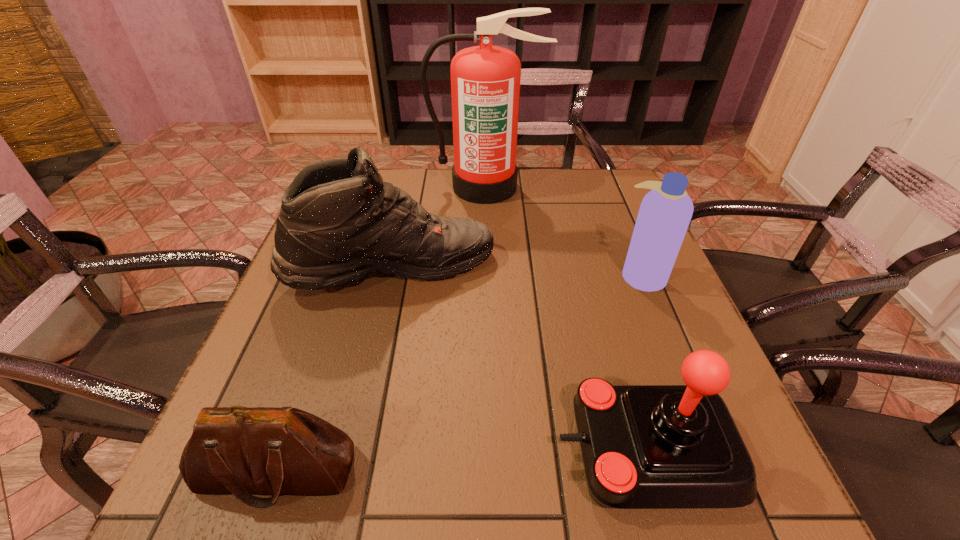
The image size is (960, 540). I want to click on vacant space that's between the shortest object and the shampoo, so click(459, 373).

This screenshot has height=540, width=960. Find the location of `vacant region between the joystick and the shoulder bag`. vacant region between the joystick and the shoulder bag is located at coordinates tap(461, 461).

At what (x,y) coordinates should I click in order to perform the action: click on vacant space that's between the shoulder bag and the ski boot. Please return your answer as a coordinate pair (x, y). Image resolution: width=960 pixels, height=540 pixels. Looking at the image, I should click on (335, 370).

Find the location of a particular element. free spot between the joystick and the ski boot is located at coordinates (518, 360).

Image resolution: width=960 pixels, height=540 pixels. What are the coordinates of `blank region between the ski boot and the shampoo` in the screenshot? It's located at (517, 273).

What are the coordinates of `free space between the shortest object and the tallest object` in the screenshot? It's located at (x=381, y=329).

The width and height of the screenshot is (960, 540). I want to click on free space between the shampoo and the ski boot, so click(517, 273).

In order to click on free point between the joystick and the ski boot in this screenshot , I will do `click(518, 360)`.

Find the location of a particular element. The image size is (960, 540). object identified as the third closest to the joystick is located at coordinates click(x=236, y=450).

Locate an element on the screen. object that ranks as the third closest to the ski boot is located at coordinates (236, 450).